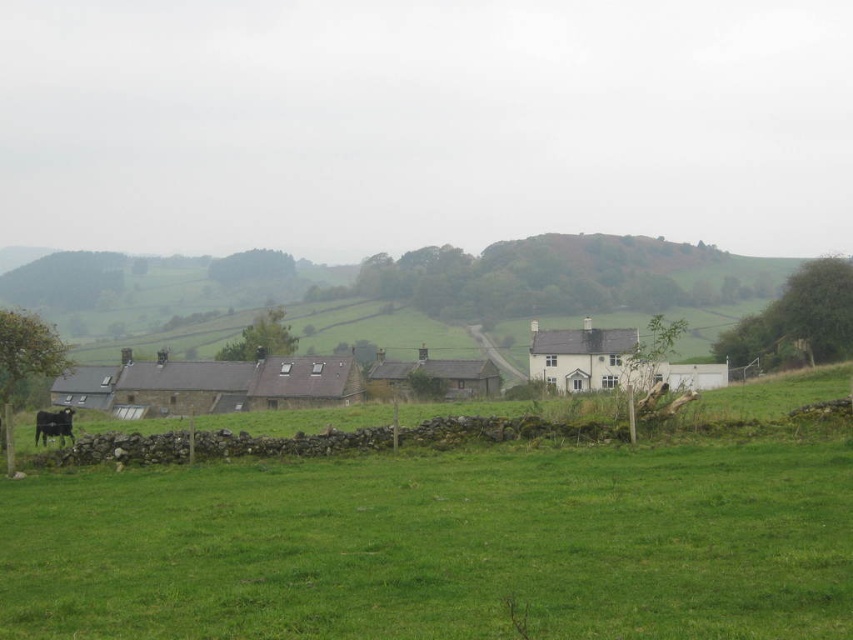
You are a sheep herder trying to guide your flock across the field. You notice the green grass at center and the black fur at lower left. Which area is wider for your sheep to graze?

The green grass at center is wider than black fur at lower left, so the sheep should graze there.